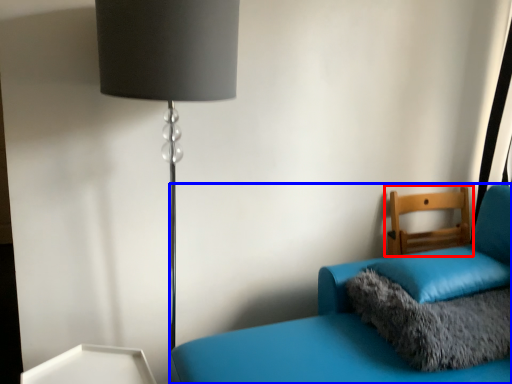
Question: Which object is further to the camera taking this photo, furniture (highlighted by a red box) or furniture (highlighted by a blue box)?

Choices:
 (A) furniture
 (B) furniture

Answer: (A)